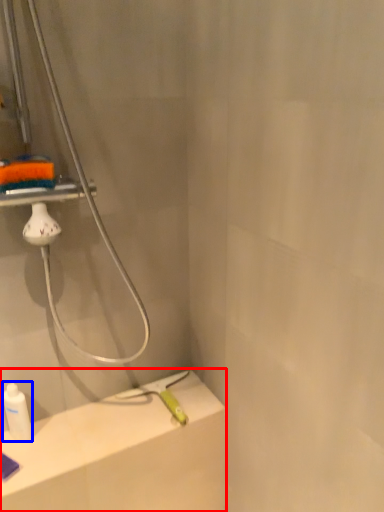
Question: Among these objects, which one is nearest to the camera, counter top (highlighted by a red box) or bottle (highlighted by a blue box)?

Choices:
 (A) counter top
 (B) bottle

Answer: (A)